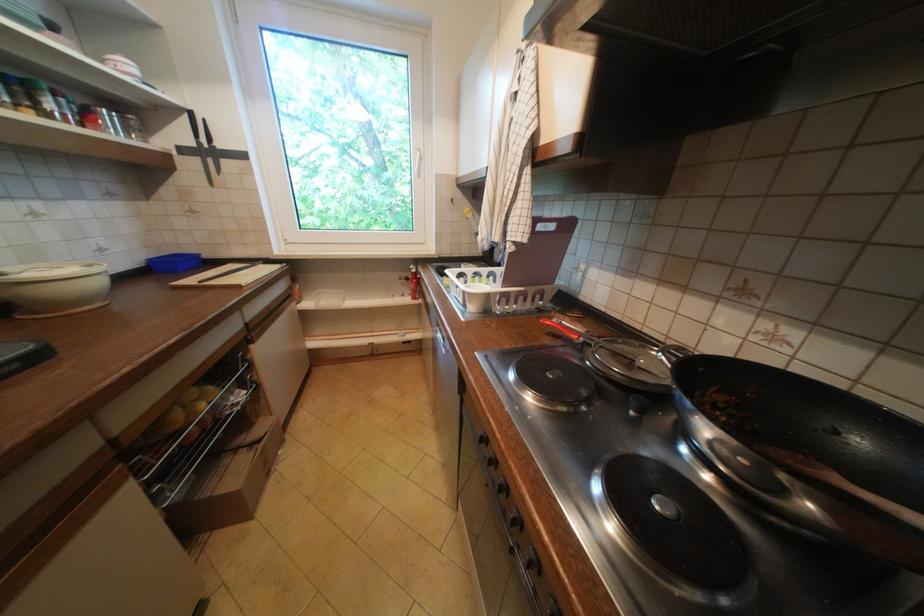
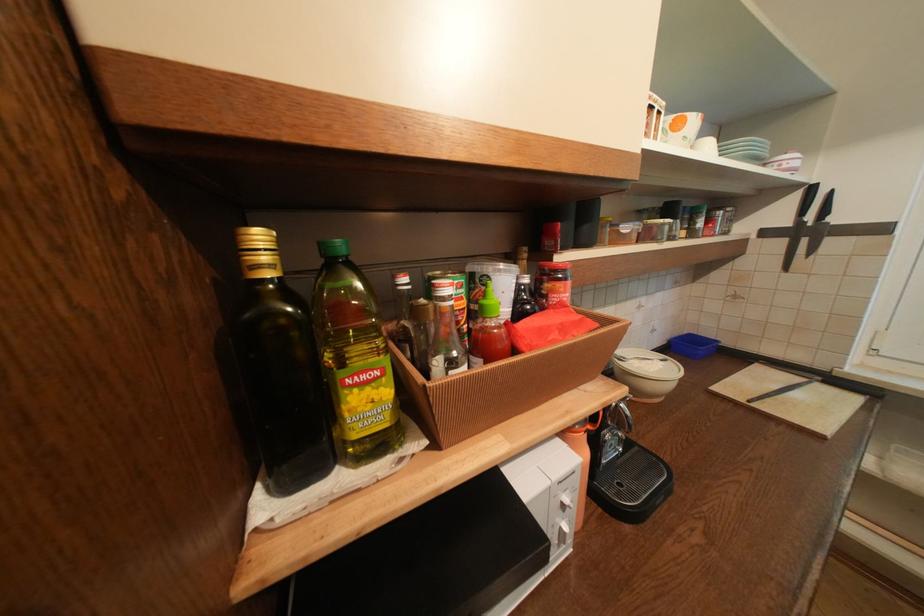
Question: The camera is either moving clockwise (left) or counter-clockwise (right) around the object. The first image is from the beginning of the video and the second image is from the end. Is the camera moving left or right when shooting the video?

Choices:
 (A) Left
 (B) Right

Answer: (B)